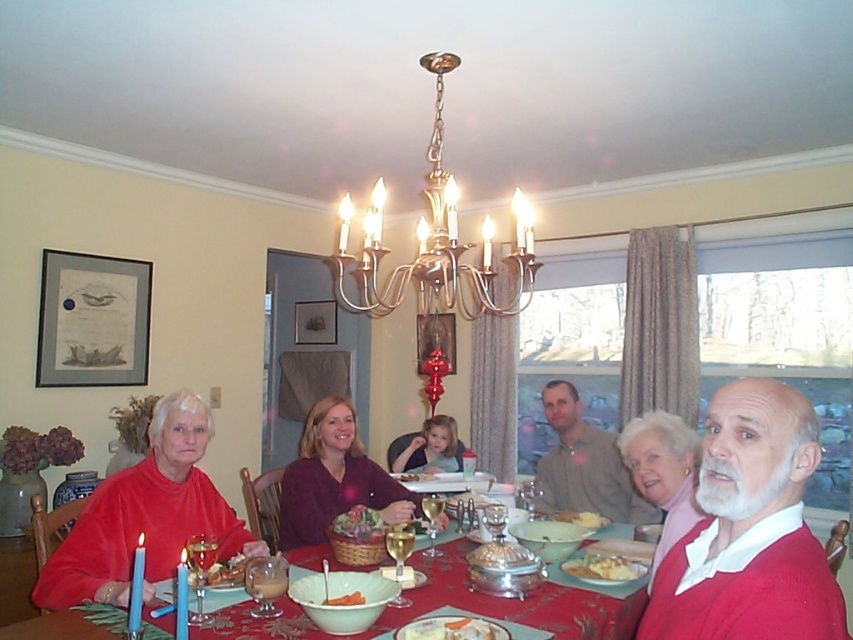
This screenshot has width=853, height=640. Find the location of `matte red sweater at center`. matte red sweater at center is located at coordinates (750, 595).

Is point (717, 451) in front of point (601, 442)?

Yes, it is.

What are the coordinates of `matte red sweater at center` in the screenshot? It's located at (750, 595).

Is polished brass chandelier at upper center to the left of white creamy bowl at center from the viewer's perspective?

No, polished brass chandelier at upper center is not to the left of white creamy bowl at center.

Who is positioned more to the left, polished brass chandelier at upper center or white creamy bowl at center?

white creamy bowl at center is more to the left.

Is point (433, 314) behind point (349, 598)?

Yes, it is behind point (349, 598).

Locate an element on the screen. The width and height of the screenshot is (853, 640). polished brass chandelier at upper center is located at coordinates (434, 240).

Who is taller, smooth wooden basket at center or white creamy bowl at center?

Standing taller between the two is smooth wooden basket at center.

What do you see at coordinates (358, 522) in the screenshot? I see `smooth wooden basket at center` at bounding box center [358, 522].

At what (x,y) coordinates should I click in order to perform the action: click on smooth wooden basket at center. Please return your answer as a coordinate pair (x, y). This screenshot has height=640, width=853. Looking at the image, I should click on (358, 522).

At what (x,y) coordinates should I click in order to perform the action: click on smooth wooden basket at center. Please return your answer as a coordinate pair (x, y). Looking at the image, I should click on (358, 522).